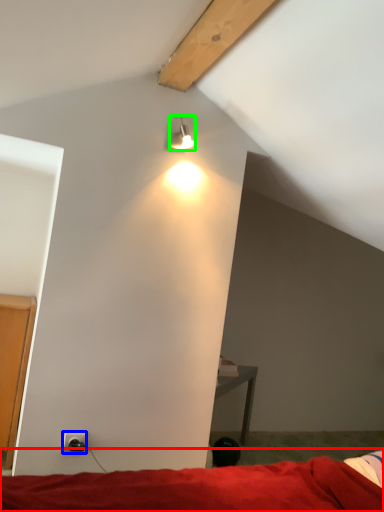
Question: Estimate the real-world distances between objects in this image. Which object is closer to bed (highlighted by a red box), power outlet (highlighted by a blue box) or lamp (highlighted by a green box)?

Choices:
 (A) power outlet
 (B) lamp

Answer: (A)